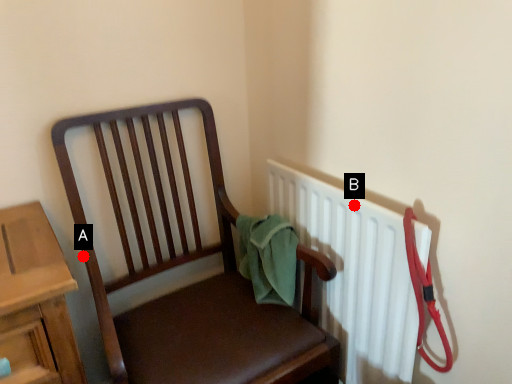
Question: Two points are circled on the image, labeled by A and B beside each circle. Which of the following is the closest to the observer?

Choices:
 (A) A is closer
 (B) B is closer

Answer: (B)